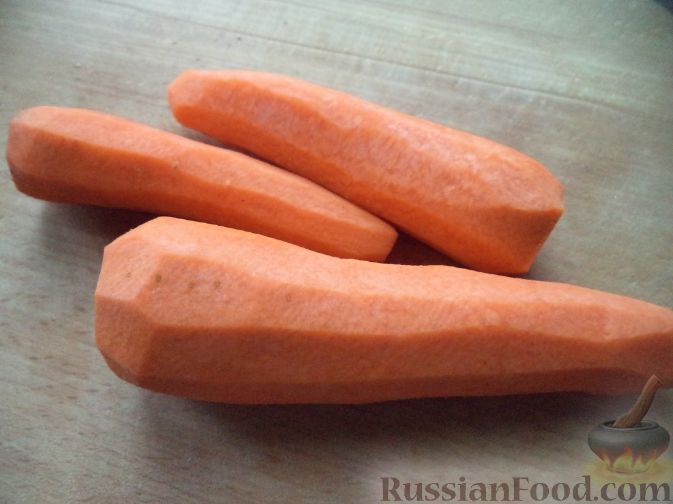
Identify the location of gray bowl. This screenshot has width=673, height=504. (621, 437).